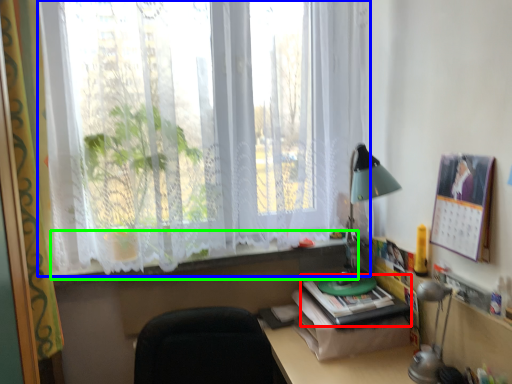
Question: Which object is the farthest from paperback book (highlighted by a red box)? Choose among these: window (highlighted by a blue box) or window sill (highlighted by a green box).

Choices:
 (A) window
 (B) window sill

Answer: (A)